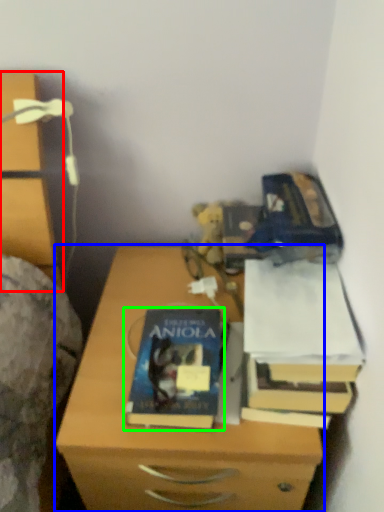
Question: Considering the real-world distances, which object is farthest from chest of drawers (highlighted by a red box)? nightstand (highlighted by a blue box) or book (highlighted by a green box)?

Choices:
 (A) nightstand
 (B) book

Answer: (B)